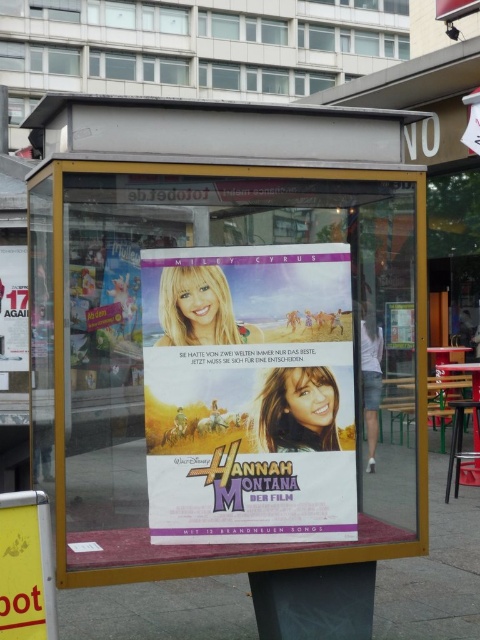
Question: Which is farther from the white glossy poster at upper left?

Choices:
 (A) transparent glass poster at center
 (B) yellow paper at lower left
 (C) matte paper poster at center

Answer: (B)

Question: Estimate the real-world distances between objects in this image. Which object is closer to the transparent glass poster at center?

Choices:
 (A) matte paper poster at center
 (B) yellow paper at lower left

Answer: (A)

Question: From the image, what is the correct spatial relationship of white concrete pavement at lower center in relation to yellow paper at lower left?

Choices:
 (A) right
 (B) left

Answer: (A)

Question: Does matte paper poster at center appear on the left side of white glossy poster at upper left?

Choices:
 (A) no
 (B) yes

Answer: (A)

Question: Which point is farther to the camera?

Choices:
 (A) [264, 376]
 (B) [64, 592]

Answer: (B)

Question: Can you confirm if matte paper poster at center is bigger than white glossy poster at upper left?

Choices:
 (A) yes
 (B) no

Answer: (A)